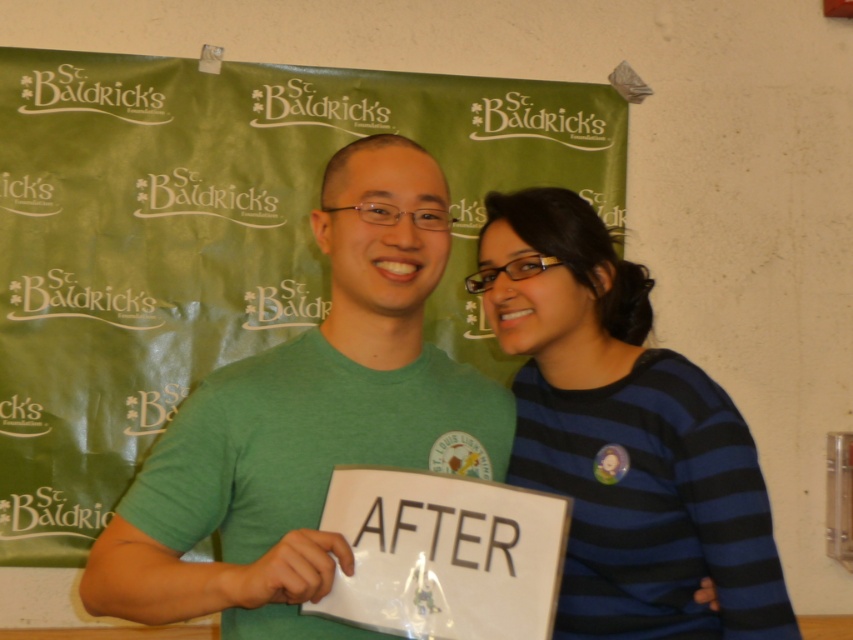
Looking at this image, which is below, green matte t-shirt at center or blue striped sweater at center?

Positioned lower is blue striped sweater at center.

Can you confirm if green matte t-shirt at center is positioned to the left of blue striped sweater at center?

Yes, green matte t-shirt at center is to the left of blue striped sweater at center.

Is point (509, 429) positioned behind point (634, 380)?

Yes, point (509, 429) is farther from viewer.

The image size is (853, 640). I want to click on green matte t-shirt at center, so click(306, 420).